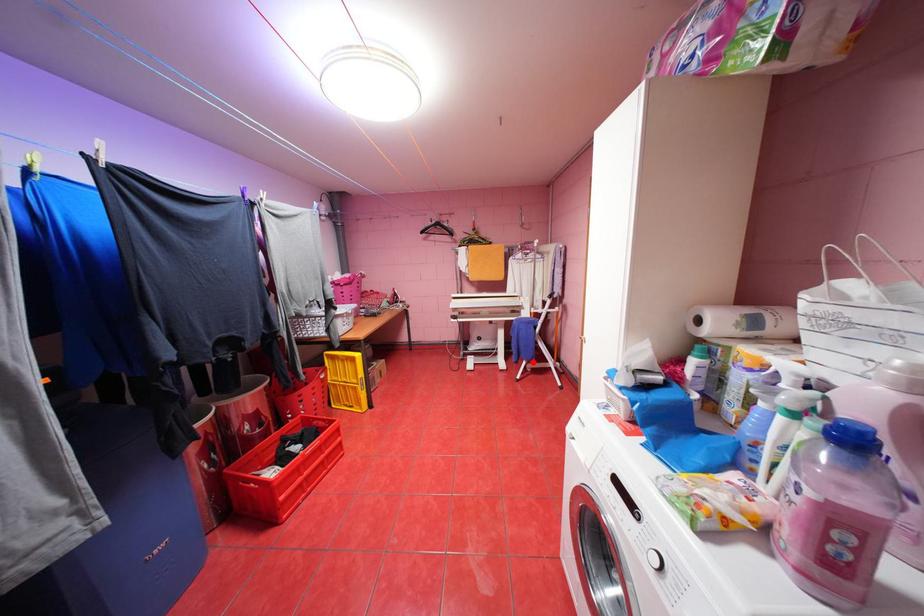
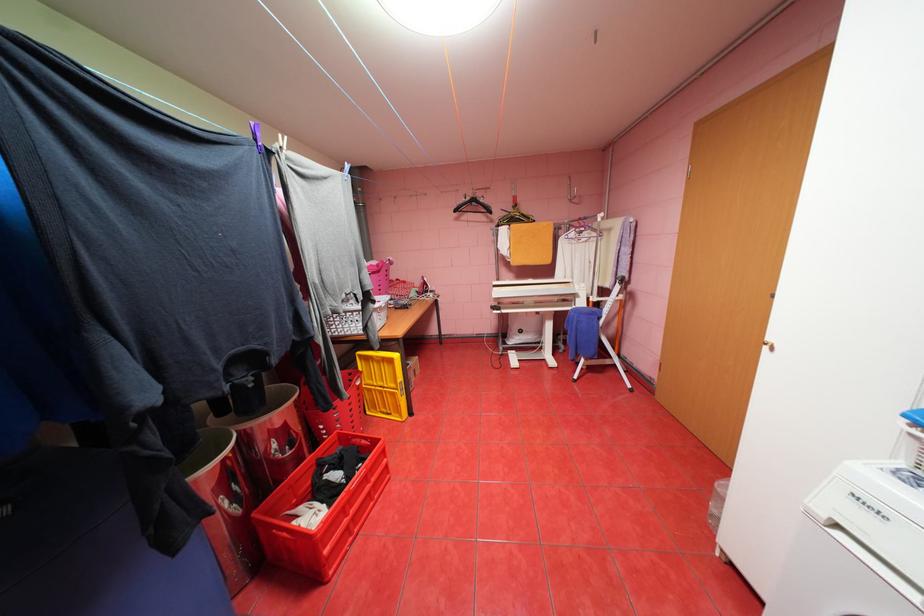
Find the pixel in the second image that matches the highlighted location in the first image.

(591, 360)